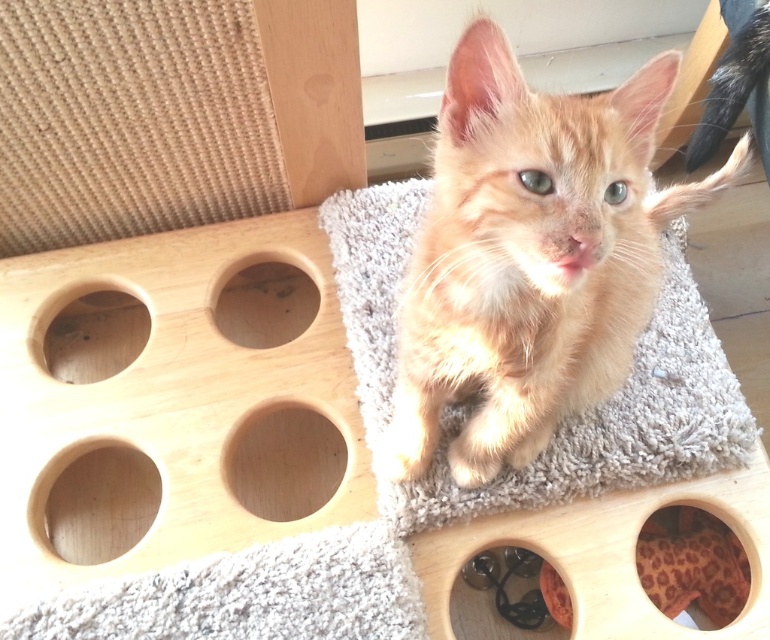
Is point (537, 374) positioned in front of point (487, 605)?

That is True.

Between orange fur cat at center and black rubber hole at lower center, which one has less height?

With less height is black rubber hole at lower center.

You are a GUI agent. You are given a task and a screenshot of the screen. Output one action in this format:
    pyautogui.click(x=<x>, y=<y>)
    Task: Click on the orange fur cat at center
    
    Given the screenshot: What is the action you would take?
    pyautogui.click(x=531, y=257)

Can you confirm if orange fur cat at center is positioned above smooth wood hole at lower left?

Yes.

Image resolution: width=770 pixels, height=640 pixels. What do you see at coordinates (531, 257) in the screenshot? I see `orange fur cat at center` at bounding box center [531, 257].

Between point (561, 321) and point (69, 362), which one is positioned behind?

The point (69, 362) is more distant.

In order to click on orange fur cat at center in this screenshot , I will do `click(531, 257)`.

Can you confirm if smooth light brown wooden hole at lower left is wider than wooden hole at center?

No, smooth light brown wooden hole at lower left is not wider than wooden hole at center.

Is smooth light brown wooden hole at lower left to the left of wooden hole at center from the viewer's perspective?

Yes, smooth light brown wooden hole at lower left is to the left of wooden hole at center.

Between point (106, 541) and point (303, 289), which one is positioned in front?

Point (106, 541) is more forward.

This screenshot has width=770, height=640. Find the location of `smooth light brown wooden hole at lower left`. smooth light brown wooden hole at lower left is located at coordinates (92, 500).